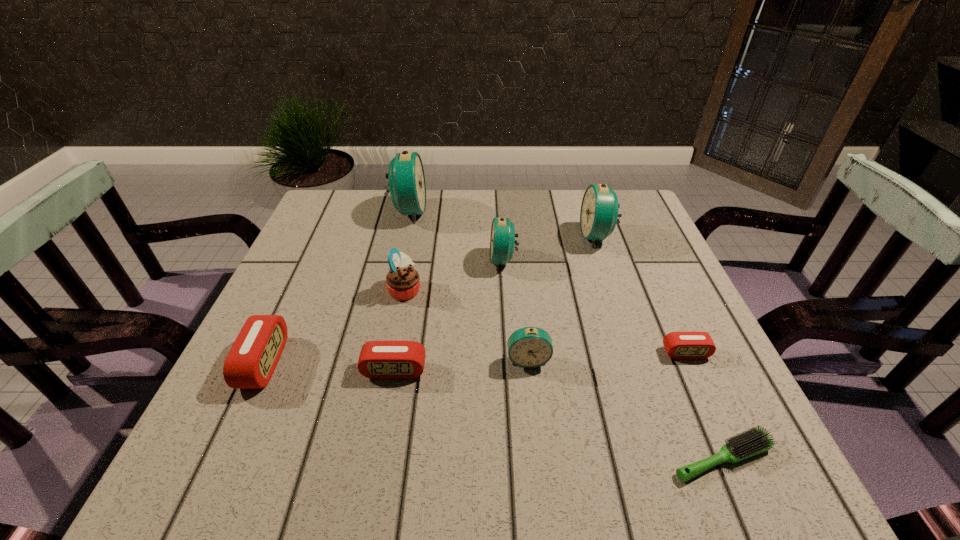
This screenshot has height=540, width=960. Find the location of `vacant space situated 0.310m on the front-facing side of the rightmost blue alarm clock`. vacant space situated 0.310m on the front-facing side of the rightmost blue alarm clock is located at coordinates (462, 236).

Where is `free space located 0.350m on the front-facing side of the third tallest alarm clock`? free space located 0.350m on the front-facing side of the third tallest alarm clock is located at coordinates (346, 260).

Locate an element on the screen. vacant space situated on the front-facing side of the third tallest alarm clock is located at coordinates [x=387, y=260].

What are the coordinates of `free point located on the front-facing side of the third tallest alarm clock` in the screenshot? It's located at (329, 260).

Identify the location of vacant region located on the front-facing side of the muffin. The width and height of the screenshot is (960, 540). (470, 289).

Locate an element on the screen. The image size is (960, 540). vacant area located on the front-facing side of the fourth tallest alarm clock is located at coordinates (539, 464).

Find the location of a particular element. Image resolution: width=960 pixels, height=540 pixels. free space located 0.240m on the front-facing side of the biggest pink alarm clock is located at coordinates (405, 363).

Locate an element on the screen. The image size is (960, 540). vacant space located on the front-facing side of the second pink alarm clock from right to left is located at coordinates (376, 471).

At what (x,y) coordinates should I click in order to perform the action: click on free region located on the front-facing side of the shortest alarm clock. Please return your answer as a coordinate pair (x, y). Looking at the image, I should click on (709, 405).

The image size is (960, 540). I want to click on vacant space located 0.190m on the back of the shortest object, so click(674, 345).